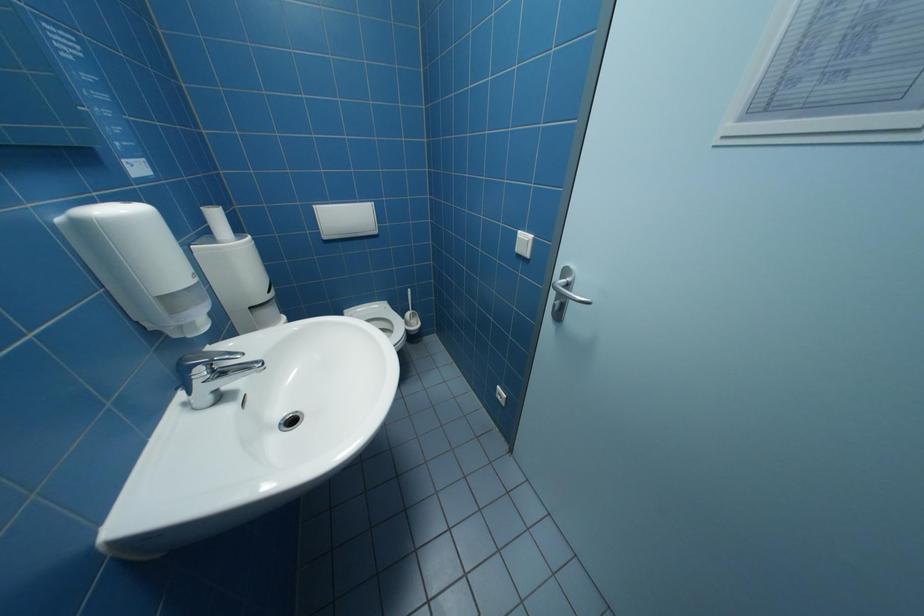
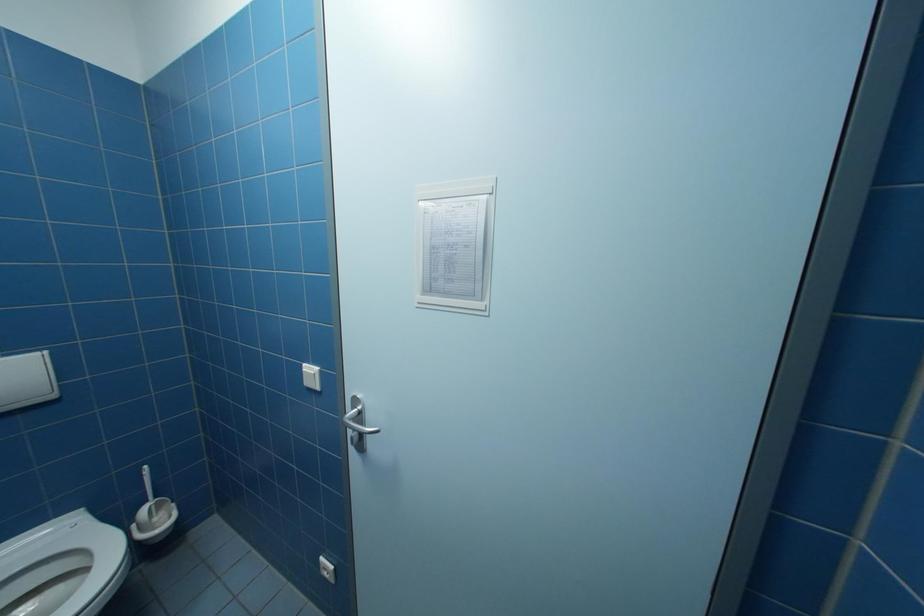
Question: The camera is either moving clockwise (left) or counter-clockwise (right) around the object. The first image is from the beginning of the video and the second image is from the end. Is the camera moving left or right when shooting the video?

Choices:
 (A) Left
 (B) Right

Answer: (A)